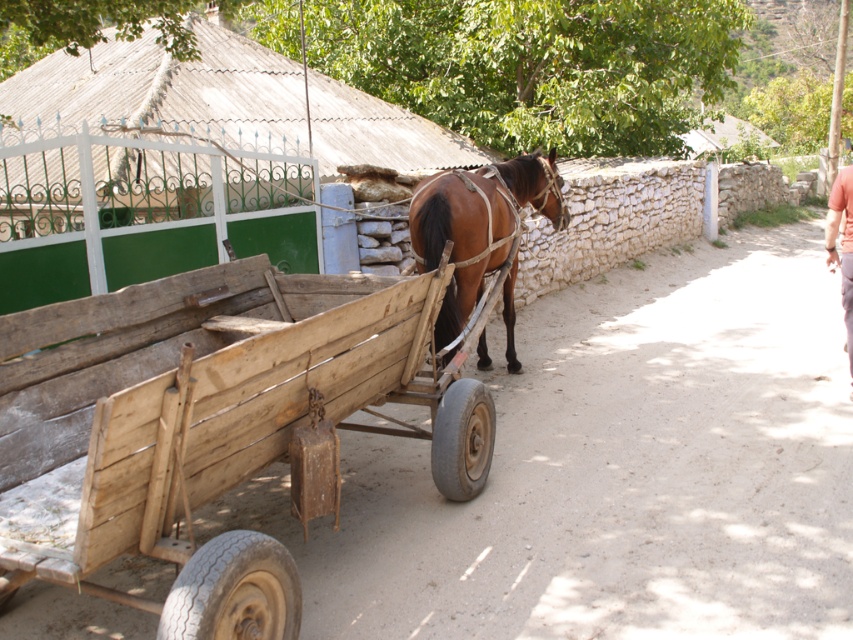
Can you confirm if wooden cart at center is taller than pink fabric pants at lower right?

Yes.

The height and width of the screenshot is (640, 853). Describe the element at coordinates (213, 422) in the screenshot. I see `wooden cart at center` at that location.

Find the location of a particular element. wooden cart at center is located at coordinates point(213,422).

Is brown glossy horse at center smaller than pink fabric pants at lower right?

Incorrect, brown glossy horse at center is not smaller in size than pink fabric pants at lower right.

Does brown glossy horse at center have a lesser width compared to pink fabric pants at lower right?

Incorrect, brown glossy horse at center's width is not less than pink fabric pants at lower right's.

Which is in front, point (509, 228) or point (825, 228)?

Point (825, 228) is in front.

You are a GUI agent. You are given a task and a screenshot of the screen. Output one action in this format:
    pyautogui.click(x=<x>, y=<y>)
    Task: Click on the brown glossy horse at center
    
    Given the screenshot: What is the action you would take?
    pyautogui.click(x=479, y=225)

Which of these two, wooden cart at center or brown glossy horse at center, stands shorter?

wooden cart at center is shorter.

Who is positioned more to the right, wooden cart at center or brown glossy horse at center?

From the viewer's perspective, brown glossy horse at center appears more on the right side.

Is point (305, 492) closer to viewer compared to point (537, 202)?

That is True.

At what (x,y) coordinates should I click in order to perform the action: click on wooden cart at center. Please return your answer as a coordinate pair (x, y). This screenshot has width=853, height=640. Looking at the image, I should click on (213, 422).